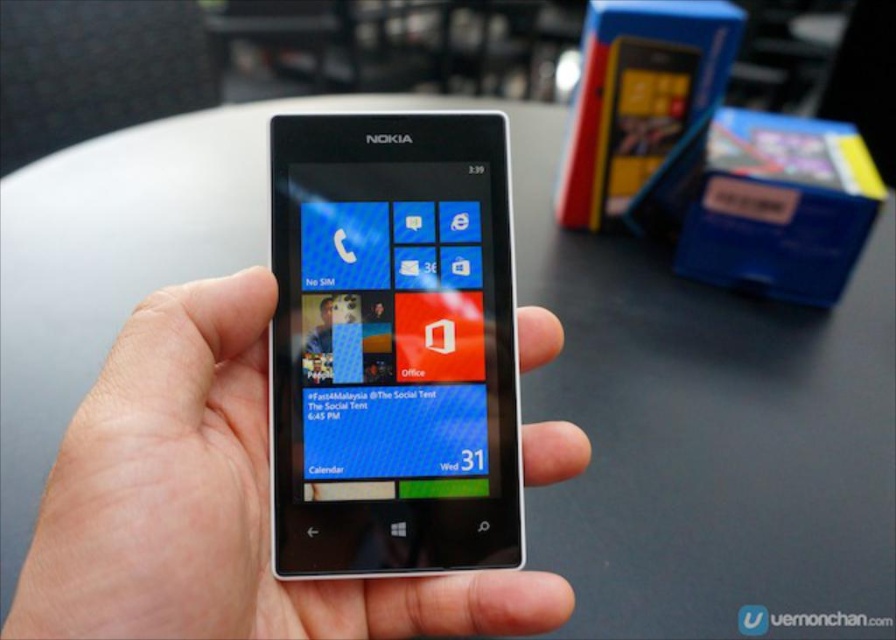
The height and width of the screenshot is (640, 896). Identify the location of white matte phone at center. (213, 504).

Does white matte phone at center have a smaller size compared to blue glossy screen at center?

Incorrect, white matte phone at center is not smaller in size than blue glossy screen at center.

Is point (48, 566) closer to camera compared to point (360, 259)?

Yes, it is in front of point (360, 259).

The width and height of the screenshot is (896, 640). Find the location of `white matte phone at center`. white matte phone at center is located at coordinates (213, 504).